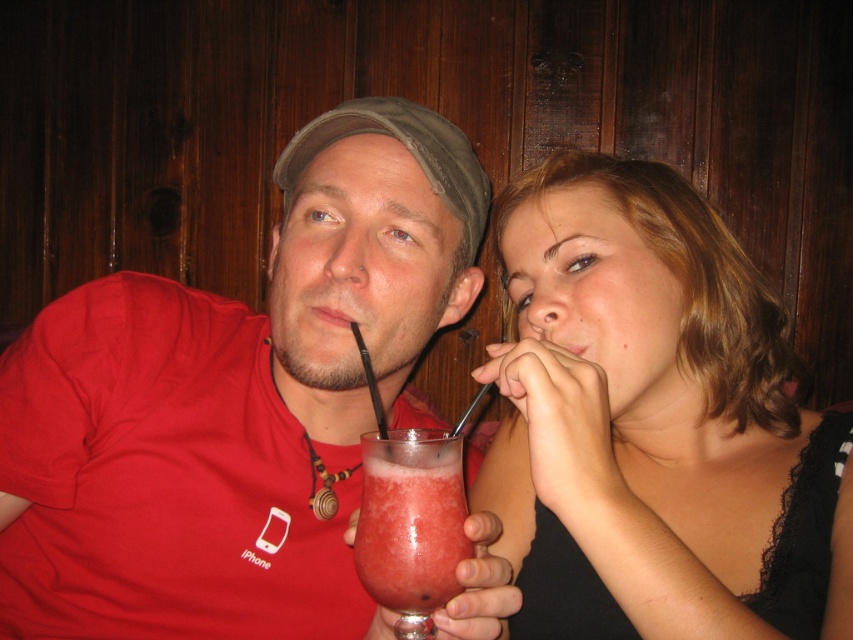
Question: Can you confirm if matte black drink at center is positioned above smoothie glass at center?

Choices:
 (A) yes
 (B) no

Answer: (A)

Question: Does matte black drink at center have a lesser width compared to smoothie glass at center?

Choices:
 (A) no
 (B) yes

Answer: (A)

Question: Which object appears farthest from the camera in this image?

Choices:
 (A) matte red shirt at center
 (B) matte black drink at center

Answer: (A)

Question: Estimate the real-world distances between objects in this image. Which object is closer to the matte red shirt at center?

Choices:
 (A) matte black drink at center
 (B) smoothie glass at center

Answer: (B)

Question: Which point appears closest to the camera in this image?

Choices:
 (A) pyautogui.click(x=454, y=470)
 (B) pyautogui.click(x=355, y=260)

Answer: (A)

Question: Is matte red shirt at center smaller than smoothie glass at center?

Choices:
 (A) no
 (B) yes

Answer: (A)